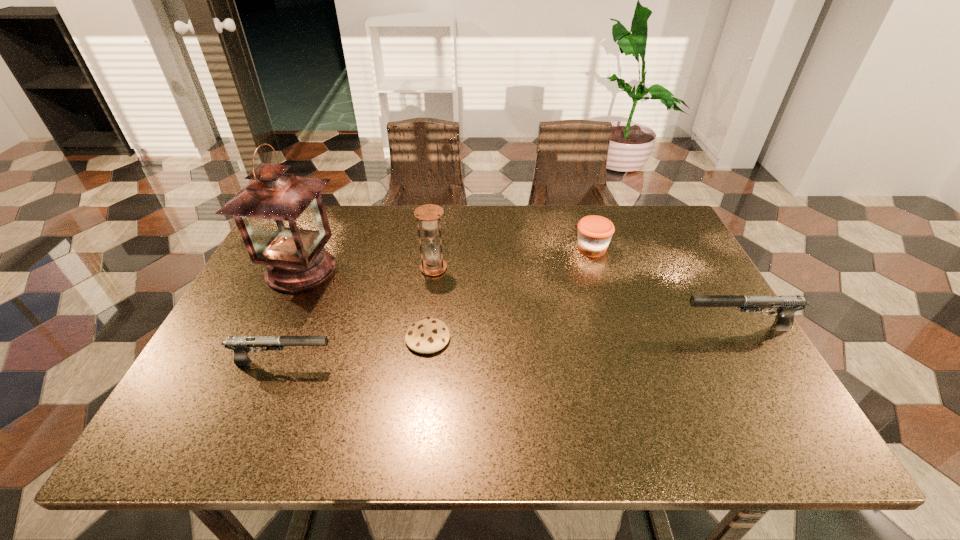
Locate an element on the screen. Image resolution: width=960 pixels, height=540 pixels. the left gun is located at coordinates (240, 345).

Find the location of a particular element. The width and height of the screenshot is (960, 540). the nearest object is located at coordinates (240, 345).

You are a GUI agent. You are given a task and a screenshot of the screen. Output one action in this format:
    pyautogui.click(x=<x>, y=<y>)
    Task: Click on the farther gun
    
    Given the screenshot: What is the action you would take?
    787,305

At what (x,y) coordinates should I click in order to perform the action: click on the third tallest object. Please return your answer as a coordinate pair (x, y). The width and height of the screenshot is (960, 540). Looking at the image, I should click on (787, 305).

Find the location of a particular element. This screenshot has width=960, height=540. hourglass is located at coordinates (429, 215).

What are the coordinates of `jam` in the screenshot? It's located at (594, 232).

The height and width of the screenshot is (540, 960). In order to click on oil lamp in this screenshot , I will do `click(281, 217)`.

Image resolution: width=960 pixels, height=540 pixels. Identify the location of cookie. (430, 335).

Image resolution: width=960 pixels, height=540 pixels. Identify the location of free space located 0.300m at the muzzle end of the left gun. (469, 362).

This screenshot has height=540, width=960. In order to click on vacant space located at the muzzle end of the fourth shortest object in this screenshot , I will do `click(543, 327)`.